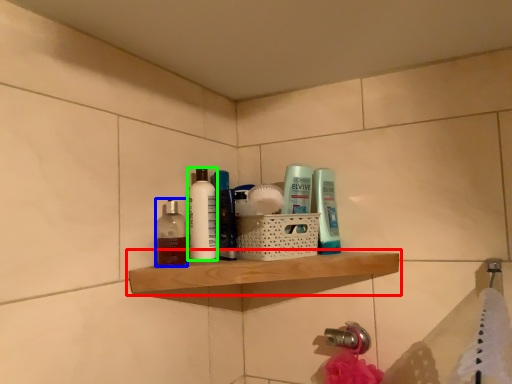
Question: Considering the real-world distances, which object is farthest from shelf (highlighted by a red box)? mouthwash (highlighted by a blue box) or toiletry (highlighted by a green box)?

Choices:
 (A) mouthwash
 (B) toiletry

Answer: (A)